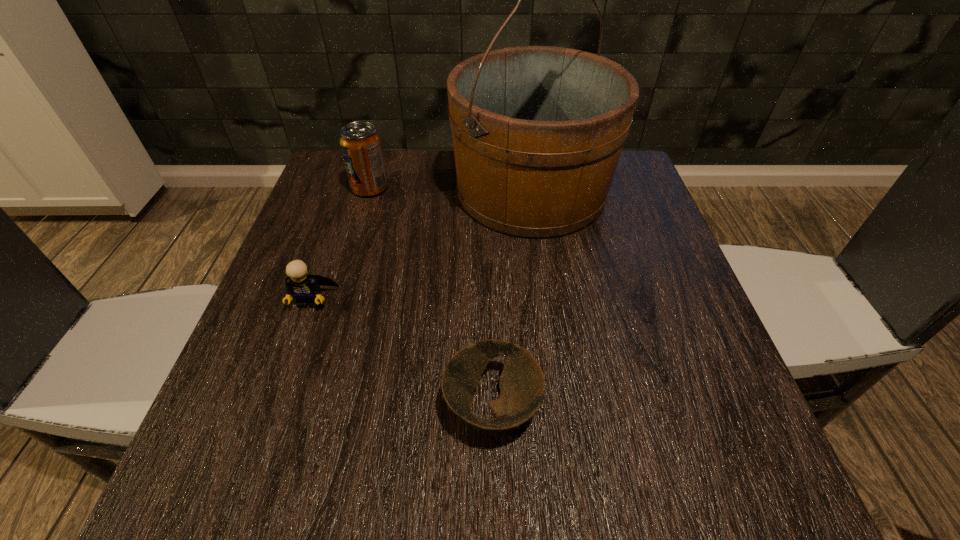
At what (x,y) coordinates should I click in order to perform the action: click on vacant space at the right edge of the desktop. Please return your answer as a coordinate pair (x, y). Looking at the image, I should click on (624, 355).

I want to click on empty space that is in between the second shortest object and the tallest object, so click(x=421, y=246).

I want to click on blank region between the tallest object and the shortest object, so click(x=512, y=299).

Find the location of `vacant area that lies between the bucket and the bowl`. vacant area that lies between the bucket and the bowl is located at coordinates (512, 299).

Identify the location of vacant point located between the bowl and the second tallest object. (431, 297).

I want to click on vacant area between the bucket and the bowl, so click(512, 299).

Identify the location of vacant area that lies between the second nearest object and the shortest object. This screenshot has width=960, height=540. (401, 353).

This screenshot has height=540, width=960. I want to click on free area in between the tallest object and the third farthest object, so click(x=421, y=246).

Find the location of a particular element. The height and width of the screenshot is (540, 960). free space that is in between the bowl and the second shortest object is located at coordinates (401, 353).

This screenshot has height=540, width=960. In order to click on free space that is in between the bucket and the Lego in this screenshot , I will do `click(421, 246)`.